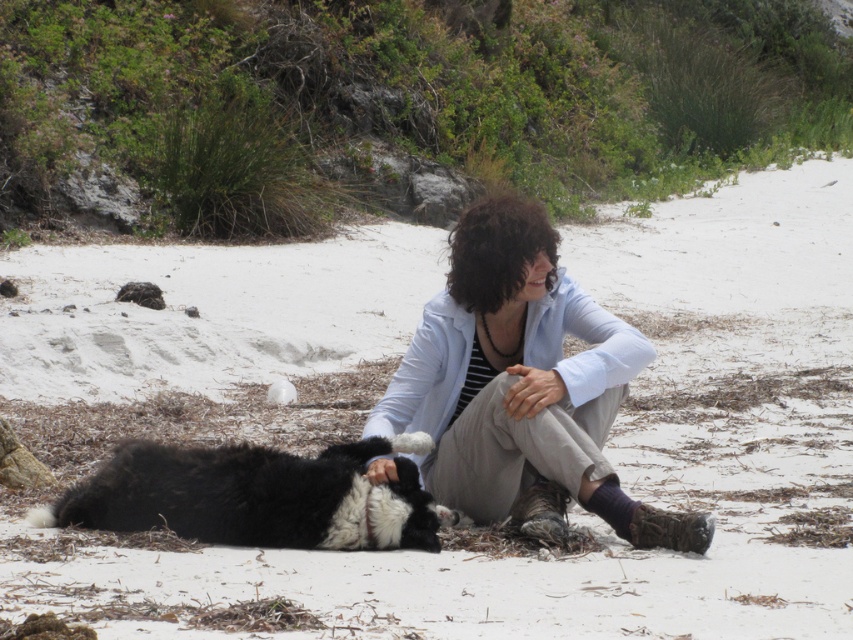
Which of these two, light blue fabric jacket at center or black fluffy dog at lower left, stands taller?

With more height is light blue fabric jacket at center.

Locate an element on the screen. Image resolution: width=853 pixels, height=640 pixels. light blue fabric jacket at center is located at coordinates tap(521, 381).